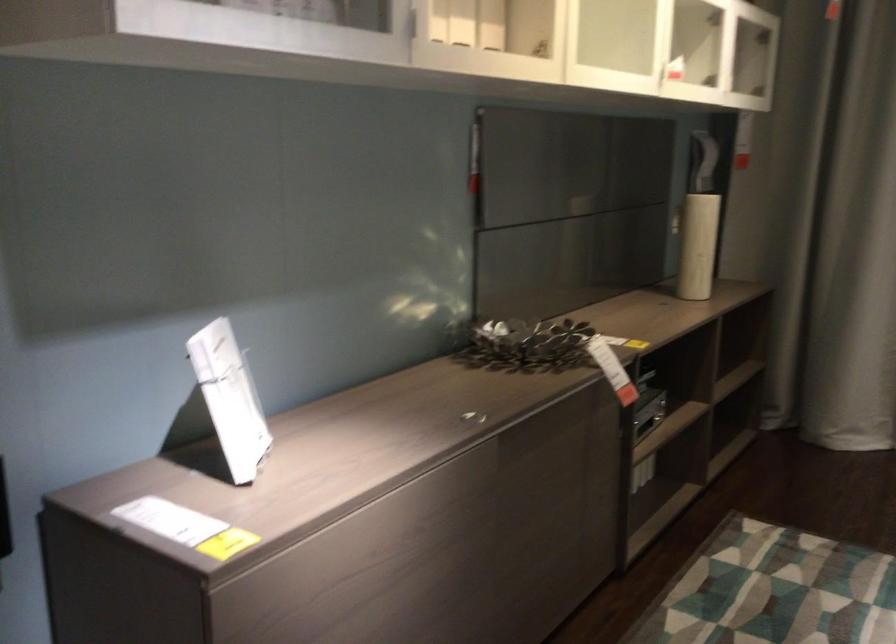
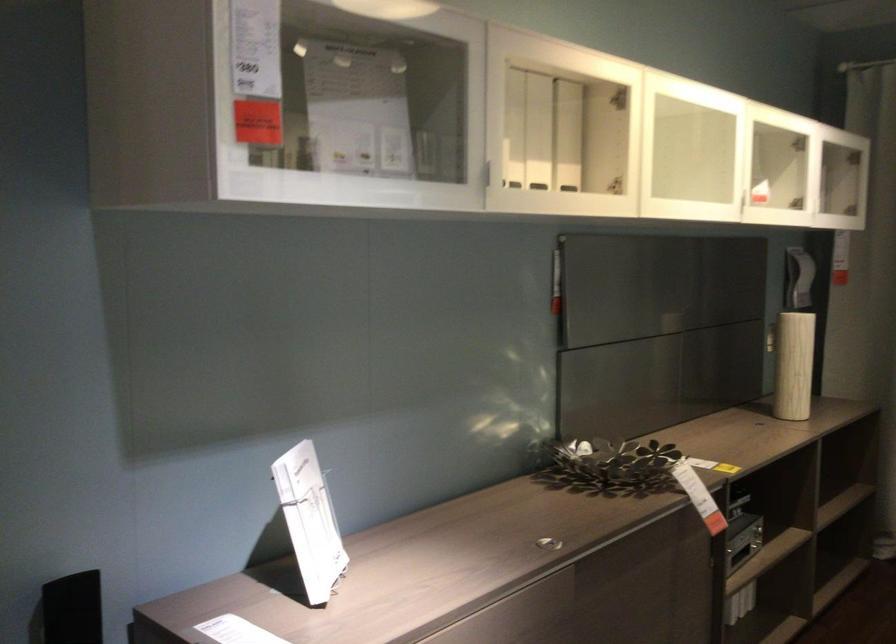
Locate, in the second image, the point that corresponds to (x=679, y=219) in the first image.

(770, 339)